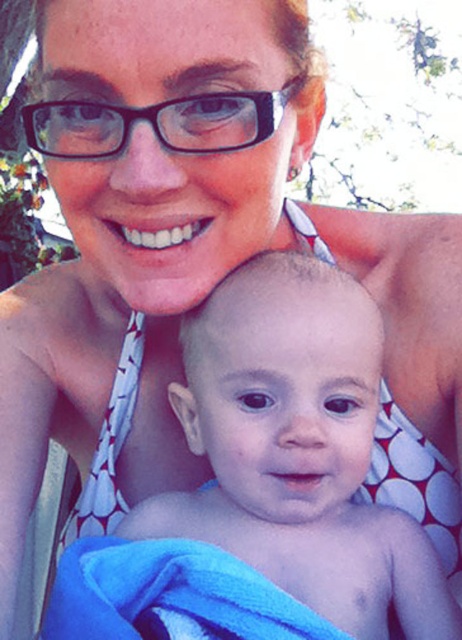
Is blue soft towel at lower left wider than black plastic glasses at upper center?

Yes, blue soft towel at lower left is wider than black plastic glasses at upper center.

Can you confirm if blue soft towel at lower left is positioned to the left of black plastic glasses at upper center?

Incorrect, blue soft towel at lower left is not on the left side of black plastic glasses at upper center.

Is point (157, 621) farther from viewer compared to point (194, 134)?

Yes, it is behind point (194, 134).

Where is `blue soft towel at lower left`? This screenshot has height=640, width=462. blue soft towel at lower left is located at coordinates (170, 595).

Does smooth skin baby at center have a greater height compared to white dotted fabric bikini top at center?

No.

Is point (350, 499) positioned before point (456, 582)?

Yes.

The height and width of the screenshot is (640, 462). I want to click on smooth skin baby at center, so click(x=297, y=449).

Does black plastic glasses at upper center have a lesser height compared to white dotted fabric bikini top at center?

Indeed, black plastic glasses at upper center has a lesser height compared to white dotted fabric bikini top at center.

Who is more distant from viewer, (91,154) or (384,486)?

Point (384,486)

Find the location of a particular element. The height and width of the screenshot is (640, 462). black plastic glasses at upper center is located at coordinates (158, 124).